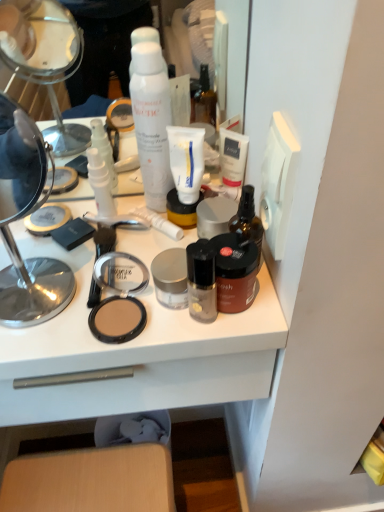
Locate an element on the screen. The image size is (384, 512). free space to the left of brown matte bottle at right is located at coordinates (101, 281).